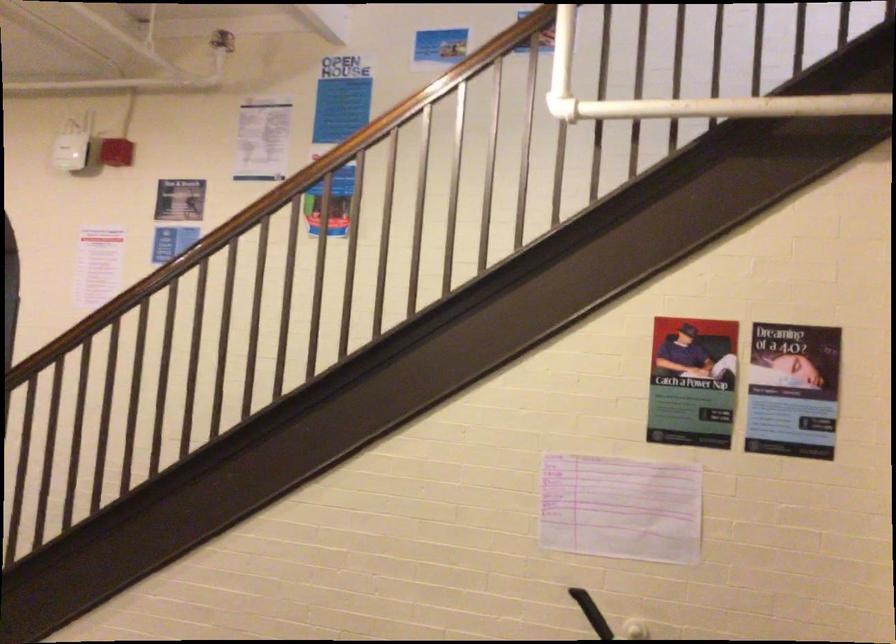
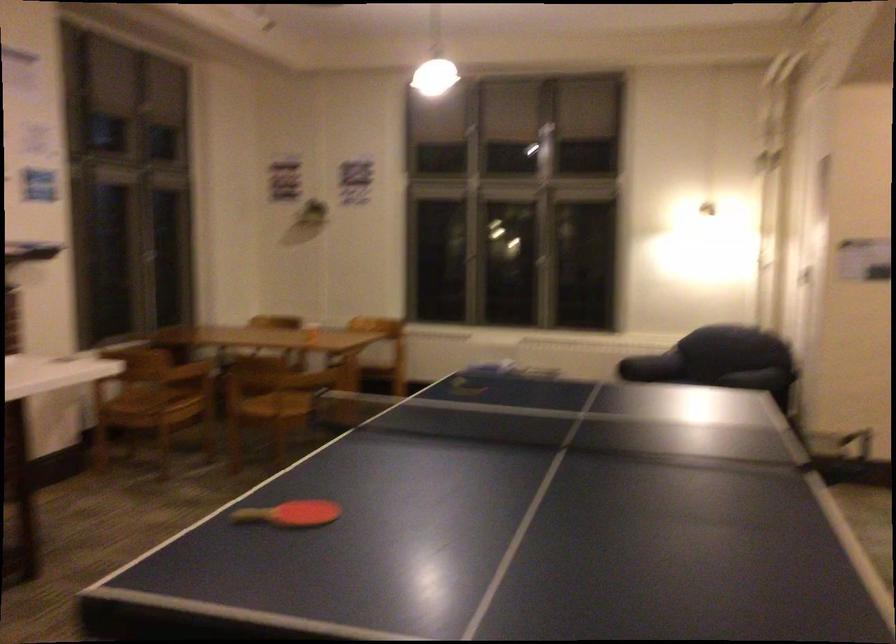
Question: The camera is either moving clockwise (left) or counter-clockwise (right) around the object. The first image is from the beginning of the video and the second image is from the end. Is the camera moving left or right when shooting the video?

Choices:
 (A) Left
 (B) Right

Answer: (B)